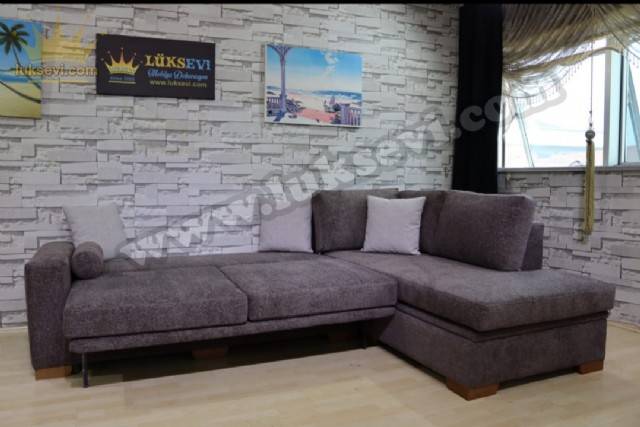
Locate an element on the screen. pillow is located at coordinates (392, 244).